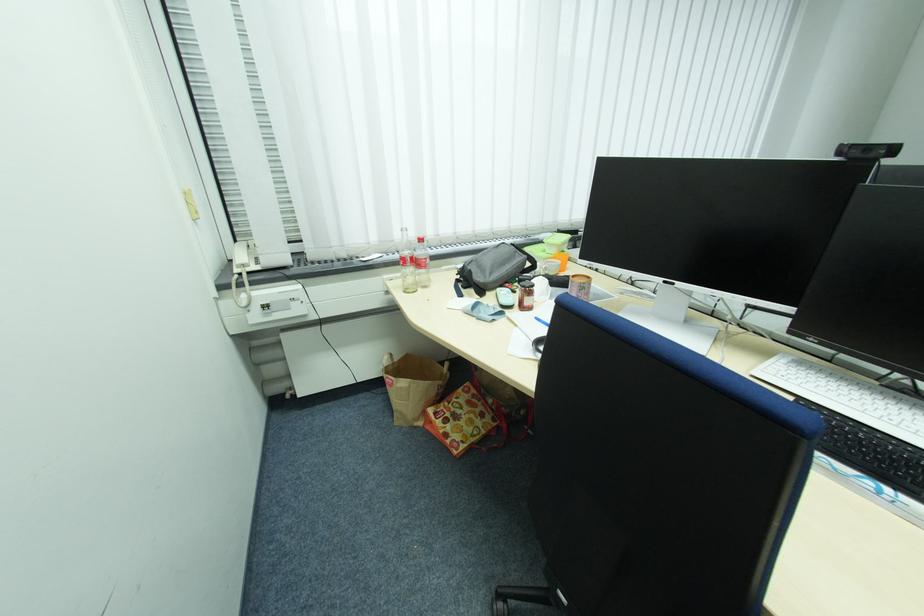
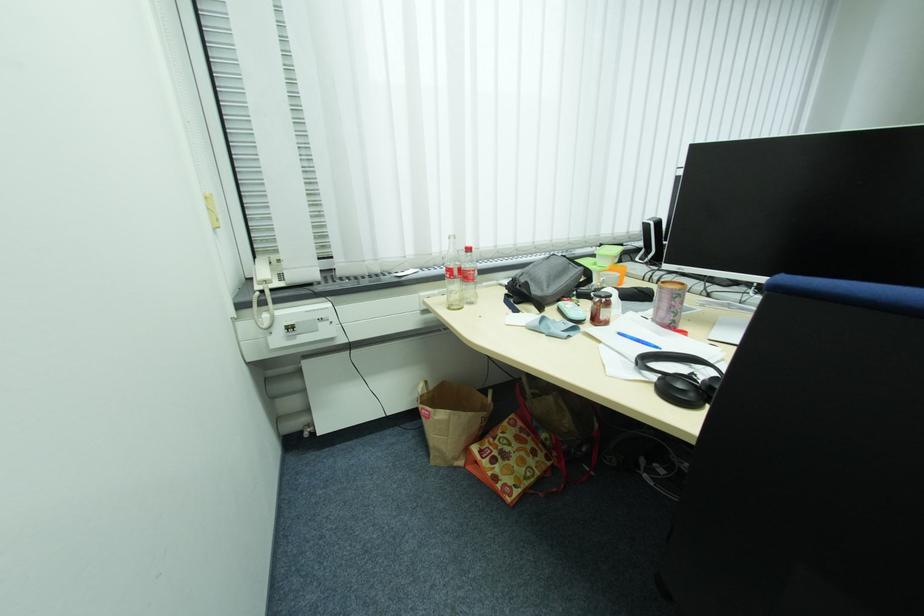
In the second image, find the point that corresponds to pixel 451 405 in the first image.

(495, 442)